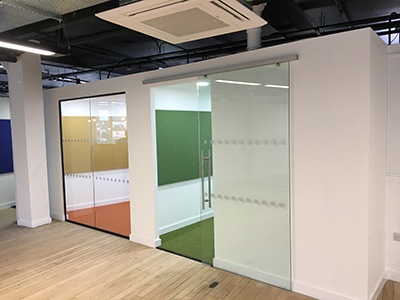
What are the coordinates of `frame` in the screenshot? It's located at pos(75,221).